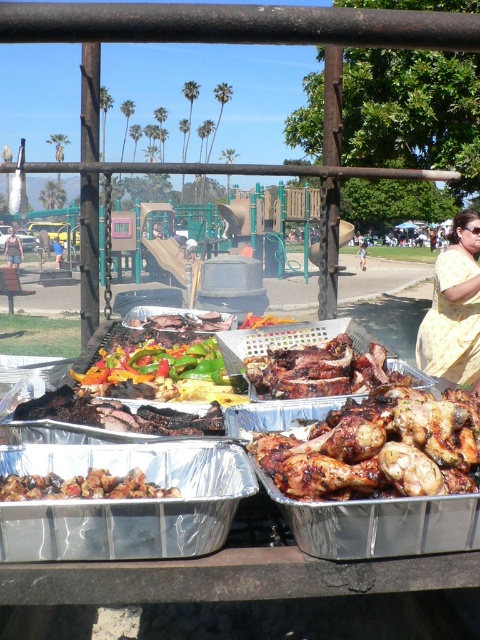
You are at a barbecue and want to grab a piece of food. You notice the grilled meat at center and the vibrant green bell peppers at center. Which one is closer to you?

The grilled meat at center is closer to the viewer than the vibrant green bell peppers at center.

You are a guest at the barbecue and want to grab a green pepper from the grill. You see the shiny green peppers at center and the yellow fabric dress at right. Which one is closer to the ground?

The shiny green peppers at center are closer to the ground since they are shorter than the yellow fabric dress at right.

You are standing at the grill and need to reach both the point at coordinate (x=326, y=353) and the point at coordinate (x=129, y=316). Which coordinate is closer to you?

The point at coordinate (x=326, y=353) is closer to you because it is in front of the point at coordinate (x=129, y=316).